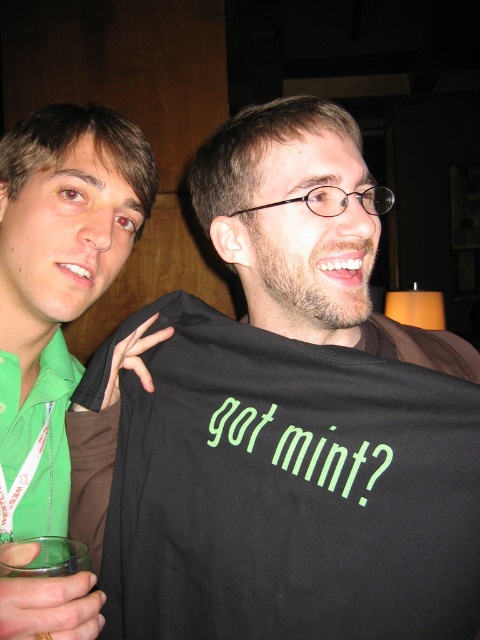
You are a fashion designer observing the two people in the image. You need to decide which fabric shirt requires more material to make between the black fabric shirt at center and the green fabric shirt at left. Based on the information provided, which one would require more fabric?

The black fabric shirt at center requires more fabric than the green fabric shirt at left because its width surpasses the latter, implying it might be larger overall.

You are standing in front of the scene and want to locate the black fabric shirt at center. According to the coordinates provided, where exactly is it positioned?

The black fabric shirt at center is located at point 0.659 along the x axis and 0.585 along the y axis.

You are organizing a clothing donation drive and need to sort shirts by size. You have a black fabric shirt at center and a green fabric shirt at left. Which shirt should you place in the large size bin?

The black fabric shirt at center is bigger than the green fabric shirt at left, so it should be placed in the large size bin.